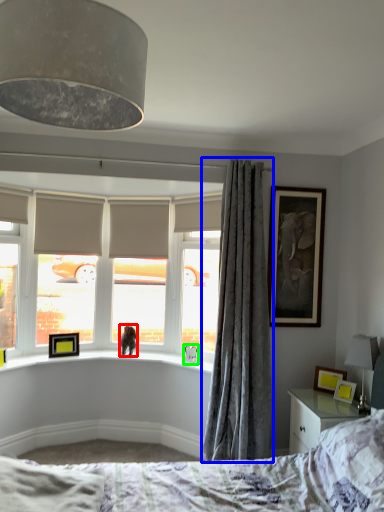
Question: Estimate the real-world distances between objects in this image. Which object is farther from animal (highlighted by a red box), curtain (highlighted by a blue box) or animal (highlighted by a green box)?

Choices:
 (A) curtain
 (B) animal

Answer: (A)